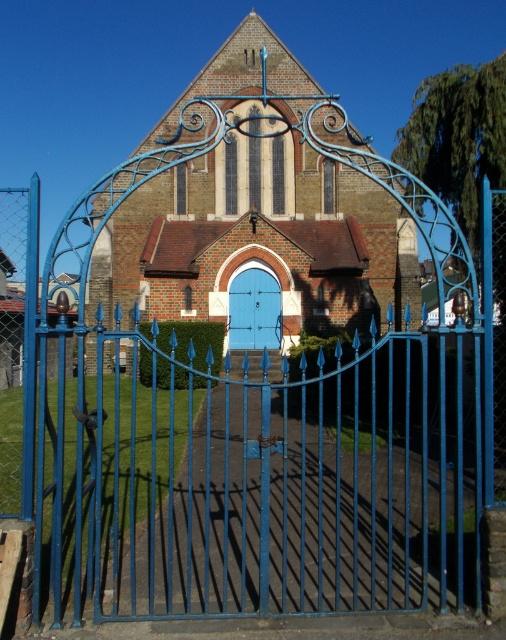
Question: Which object is closer to the camera taking this photo?

Choices:
 (A) blue metal gate at center
 (B) blue matte door at center

Answer: (A)

Question: Which point is farther to the camera?

Choices:
 (A) (101, 426)
 (B) (255, 307)
 (C) (293, 200)

Answer: (C)

Question: Is brick church at center thinner than blue matte door at center?

Choices:
 (A) yes
 (B) no

Answer: (B)

Question: Which point appears closest to the camera in this image?

Choices:
 (A) (269, 212)
 (B) (260, 298)
 (C) (177, 440)

Answer: (C)

Question: Is blue metal gate at center in front of blue matte door at center?

Choices:
 (A) no
 (B) yes

Answer: (B)

Question: Considering the relative positions of blue metal gate at center and brick church at center in the image provided, where is blue metal gate at center located with respect to brick church at center?

Choices:
 (A) below
 (B) above

Answer: (A)